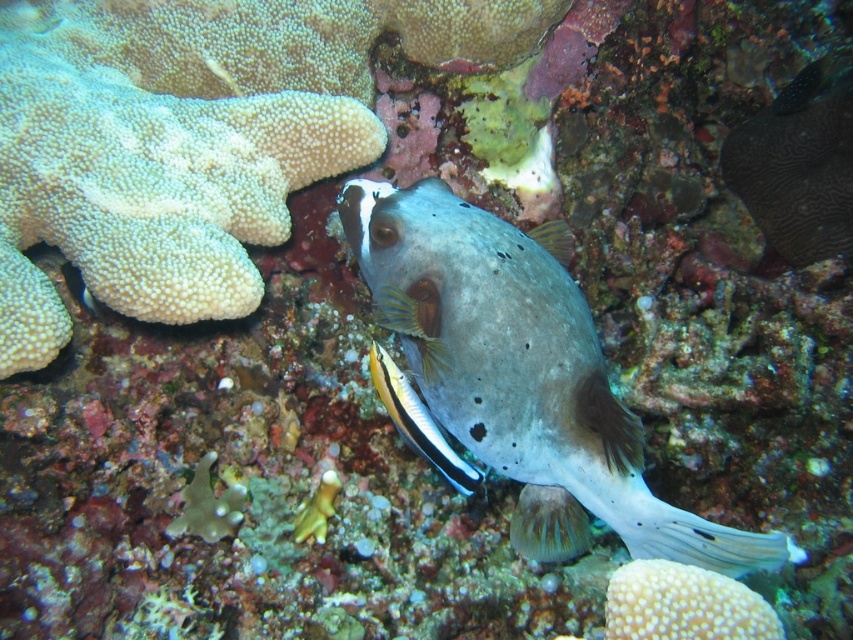
You are a marine biologist observing underwater. You see the speckled gray pufferfish at center. Can you estimate how far it is from you?

The speckled gray pufferfish at center is 35.03 inches from the viewer.

You are a diver observing the underwater scene. You notice two points marked in the image. Which point is closer to you, point (554, 300) or point (422, 417)?

Point (554, 300) is further to the viewer than point (422, 417), so point (422, 417) is closer to you.